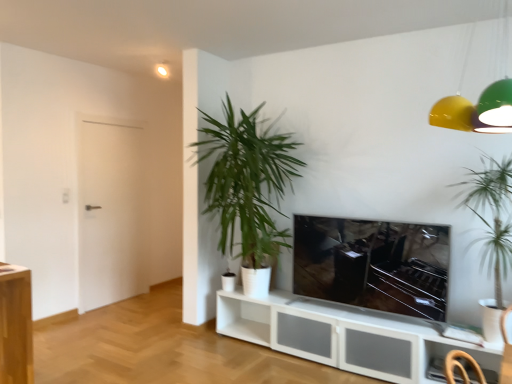
Question: Is green leafy plant at center, the 2th houseplant when ordered from front to back, at the back of white matte door at left?

Choices:
 (A) no
 (B) yes

Answer: (A)

Question: From the image's perspective, is white matte door at left located beneath green leafy plant at center, the 2th houseplant when ordered from front to back?

Choices:
 (A) yes
 (B) no

Answer: (A)

Question: Considering the relative sizes of white matte door at left and green leafy plant at center, the 2th houseplant when ordered from front to back, in the image provided, is white matte door at left shorter than green leafy plant at center, the 2th houseplant when ordered from front to back,?

Choices:
 (A) yes
 (B) no

Answer: (B)

Question: Is white matte door at left at the right side of green leafy plant at center, the 2th houseplant when ordered from front to back?

Choices:
 (A) yes
 (B) no

Answer: (B)

Question: From a real-world perspective, is white matte door at left over green leafy plant at center, the 2th houseplant when ordered from front to back?

Choices:
 (A) yes
 (B) no

Answer: (B)

Question: Choose the correct answer: Is white matte door at left inside matte black tv at center or outside it?

Choices:
 (A) outside
 (B) inside

Answer: (A)

Question: From a real-world perspective, is white matte door at left above or below matte black tv at center?

Choices:
 (A) above
 (B) below

Answer: (A)

Question: Is white matte door at left to the left or to the right of matte black tv at center in the image?

Choices:
 (A) left
 (B) right

Answer: (A)

Question: Looking at the image, does white matte door at left seem bigger or smaller compared to matte black tv at center?

Choices:
 (A) big
 (B) small

Answer: (A)

Question: Which is correct: yellow matte lampshade at upper right is inside green leafy plant at center, the 2th houseplant when ordered from front to back, or outside of it?

Choices:
 (A) inside
 (B) outside

Answer: (B)

Question: From a real-world perspective, is yellow matte lampshade at upper right above or below green leafy plant at center, the 2th houseplant viewed from the right?

Choices:
 (A) below
 (B) above

Answer: (B)

Question: Considering their positions, is yellow matte lampshade at upper right located in front of or behind green leafy plant at center, the 2th houseplant viewed from the right?

Choices:
 (A) behind
 (B) front

Answer: (B)

Question: Considering the positions of yellow matte lampshade at upper right and green leafy plant at center, the 2th houseplant viewed from the right, in the image, is yellow matte lampshade at upper right wider or thinner than green leafy plant at center, the 2th houseplant viewed from the right,?

Choices:
 (A) wide
 (B) thin

Answer: (B)

Question: In terms of width, does yellow matte lampshade at upper right look wider or thinner when compared to matte black tv at center?

Choices:
 (A) wide
 (B) thin

Answer: (A)

Question: Relative to matte black tv at center, is yellow matte lampshade at upper right in front or behind?

Choices:
 (A) front
 (B) behind

Answer: (A)